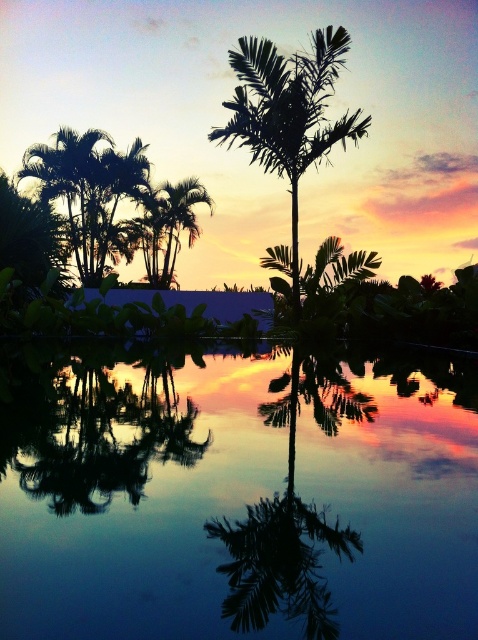
Is point (129, 438) less distant than point (193, 241)?

Yes, point (129, 438) is closer to viewer.

Consider the image. Does black glossy palm tree at center appear over green leafy palm tree at center?

No, black glossy palm tree at center is not above green leafy palm tree at center.

Which is behind, point (15, 461) or point (206, 196)?

The point (206, 196) is more distant.

Where is `black glossy palm tree at center`? This screenshot has width=478, height=640. black glossy palm tree at center is located at coordinates (104, 436).

Is black glossy palm tree at center wider than silhouette leafy palm at center?

No.

How much distance is there between black glossy palm tree at center and silhouette leafy palm at center?

30.10 feet

Between point (83, 492) and point (262, 92), which one is positioned behind?

Point (262, 92)

Identify the location of black glossy palm tree at center. The height and width of the screenshot is (640, 478). (104, 436).

Does transparent glass pond at center appear on the left side of green leafy palm tree at center?

In fact, transparent glass pond at center is to the right of green leafy palm tree at center.

Which is above, transparent glass pond at center or green leafy palm tree at center?

green leafy palm tree at center is higher up.

Who is more forward, (462, 440) or (183, 211)?

Positioned in front is point (462, 440).

You are a GUI agent. You are given a task and a screenshot of the screen. Output one action in this format:
    pyautogui.click(x=<x>, y=<y>)
    Task: Click on the transparent glass pond at center
    This screenshot has width=478, height=640.
    Given the screenshot: What is the action you would take?
    pyautogui.click(x=236, y=493)